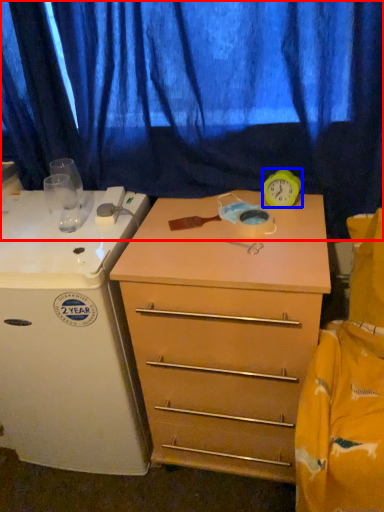
Question: Which object is closer to the camera taking this photo, curtain (highlighted by a red box) or clock (highlighted by a blue box)?

Choices:
 (A) curtain
 (B) clock

Answer: (A)